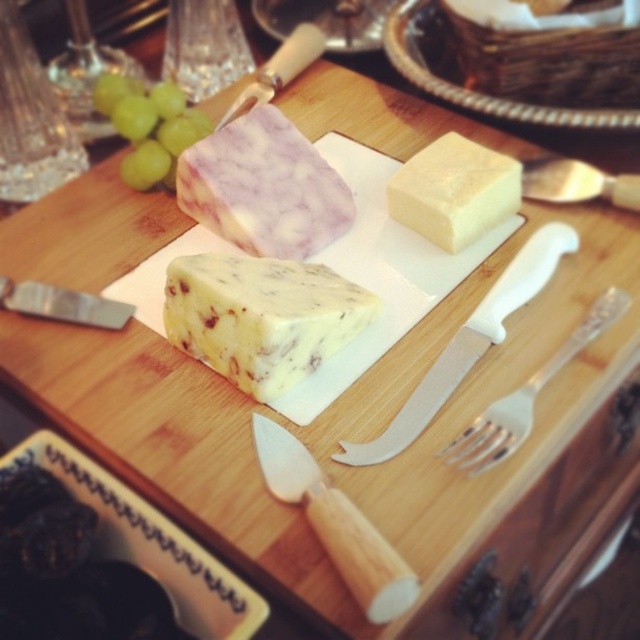
Question: Can you confirm if yellow cheese at center is positioned to the right of matte wicker basket at upper center?

Choices:
 (A) yes
 (B) no

Answer: (B)

Question: Which is farther from the wooden handle cheese knife at center?

Choices:
 (A) white creamy cheese at center
 (B) green shiny grapes at upper left

Answer: (B)

Question: Does silver metallic fork at lower right have a greater width compared to silver metallic knife at lower left?

Choices:
 (A) no
 (B) yes

Answer: (B)

Question: Is yellow cheese at center thinner than silver metallic knife at lower left?

Choices:
 (A) no
 (B) yes

Answer: (A)

Question: Which of the following is the closest to the observer?

Choices:
 (A) silvermetallicspoon at right
 (B) green shiny grapes at upper left
 (C) matte wicker basket at upper center

Answer: (A)

Question: Which object is positioned closest to the silver metallic knife at lower left?

Choices:
 (A) yellow cheese at center
 (B) purple marbled cheese at center

Answer: (B)